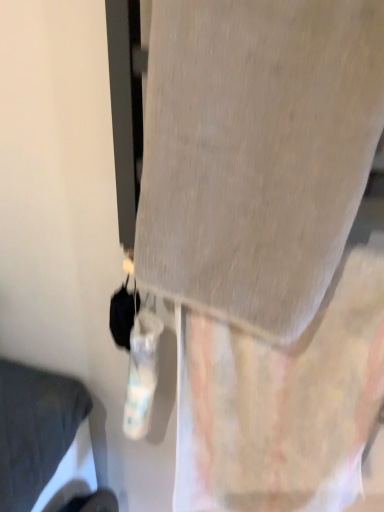
Question: Could you tell me if textured beige curtain at center is facing matte gray pillow at lower left?

Choices:
 (A) no
 (B) yes

Answer: (A)

Question: Is the surface of textured beige curtain at center in direct contact with matte gray pillow at lower left?

Choices:
 (A) yes
 (B) no

Answer: (B)

Question: Does textured beige curtain at center have a greater height compared to matte gray pillow at lower left?

Choices:
 (A) yes
 (B) no

Answer: (B)

Question: Considering the relative sizes of textured beige curtain at center and matte gray pillow at lower left in the image provided, is textured beige curtain at center thinner than matte gray pillow at lower left?

Choices:
 (A) no
 (B) yes

Answer: (B)

Question: Is textured beige curtain at center positioned with its back to matte gray pillow at lower left?

Choices:
 (A) yes
 (B) no

Answer: (B)

Question: Choose the correct answer: Is gray fabric at center inside matte gray pillow at lower left or outside it?

Choices:
 (A) inside
 (B) outside

Answer: (B)

Question: Is gray fabric at center bigger or smaller than matte gray pillow at lower left?

Choices:
 (A) small
 (B) big

Answer: (A)

Question: Is point (322, 257) positioned closer to the camera than point (74, 398)?

Choices:
 (A) closer
 (B) farther

Answer: (A)

Question: Is gray fabric at center wider or thinner than matte gray pillow at lower left?

Choices:
 (A) wide
 (B) thin

Answer: (B)

Question: Is gray fabric at center taller or shorter than textured beige curtain at center?

Choices:
 (A) short
 (B) tall

Answer: (A)

Question: Visually, is gray fabric at center positioned to the left or to the right of textured beige curtain at center?

Choices:
 (A) right
 (B) left

Answer: (B)

Question: Considering the positions of point (213, 170) and point (314, 443), is point (213, 170) closer or farther from the camera than point (314, 443)?

Choices:
 (A) closer
 (B) farther

Answer: (A)

Question: Relative to textured beige curtain at center, is gray fabric at center in front or behind?

Choices:
 (A) behind
 (B) front

Answer: (B)

Question: Is textured beige curtain at center to the left or to the right of gray fabric at center in the image?

Choices:
 (A) right
 (B) left

Answer: (A)

Question: In the image, is textured beige curtain at center positioned in front of or behind gray fabric at center?

Choices:
 (A) front
 (B) behind

Answer: (B)